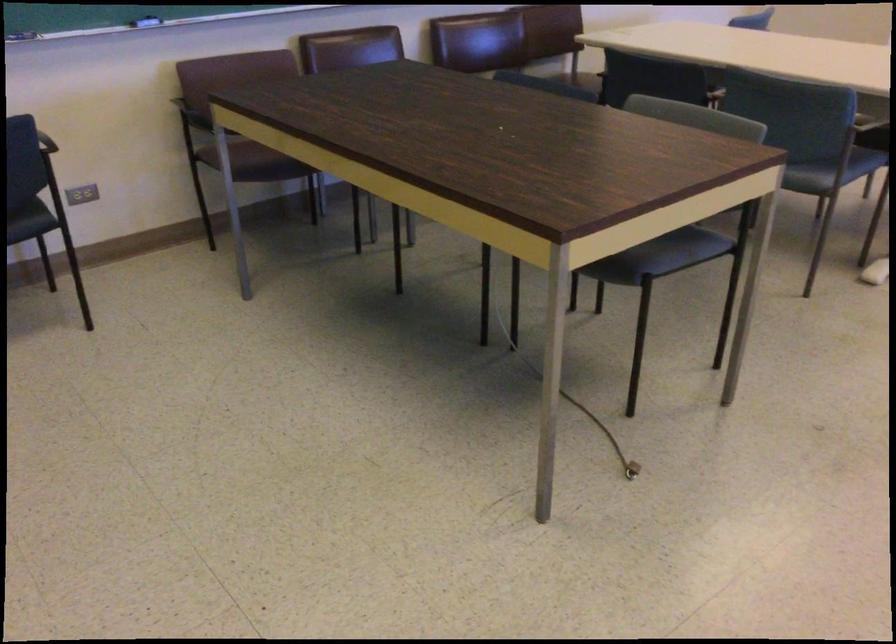
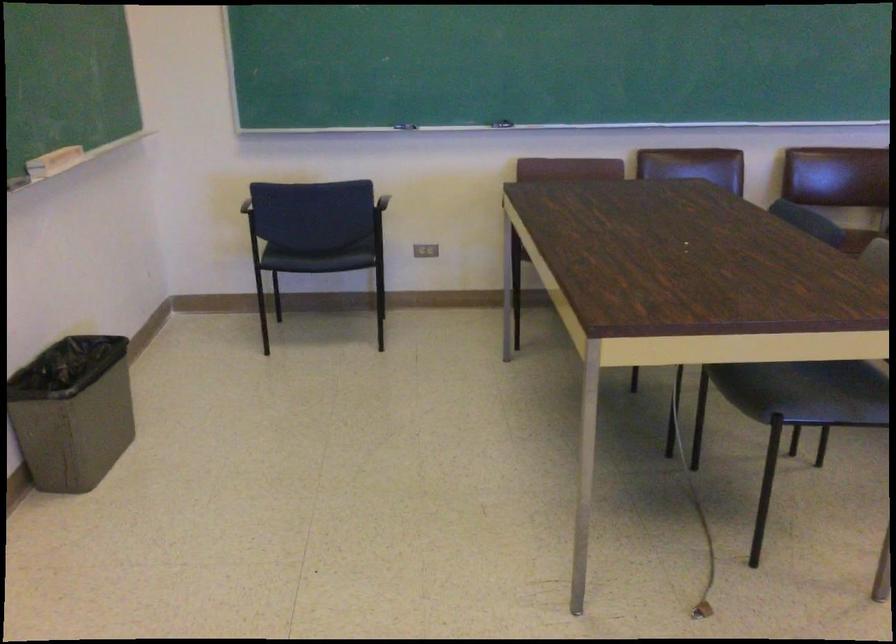
The point at (x=95, y=200) is marked in the first image. Where is the corresponding point in the second image?

(425, 250)